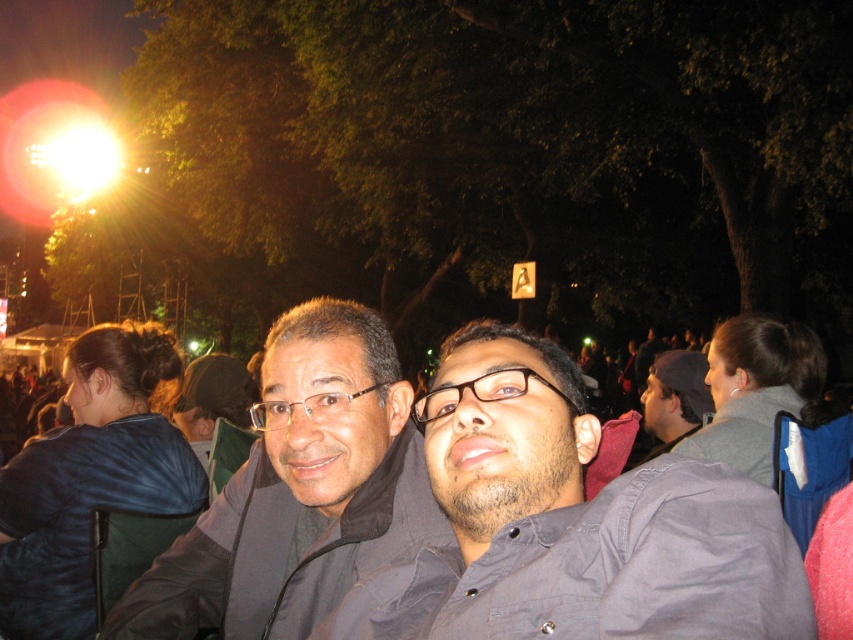
You are organizing a photo shoot and need to ensure that the dark gray shirt at center and the matte black jacket at center can fit side by side on a backdrop. The backdrop is 1.2 meters wide. What should you consider about their widths?

The dark gray shirt at center is narrower than the matte black jacket at center. To determine if they can fit side by side on a 1.2 meter backdrop, you need to know the combined width of both items. Since the jacket is wider, ensuring their total width does not exceed 1.2 meters is crucial.

Consider the image. You are a photographer trying to capture a clear photo of the dark gray shirt at center and the matte black jacket at center. Since both are at the center, which one is closer to the camera?

The dark gray shirt at center is in front of the matte black jacket at center, so it is closer to the camera.

You are organizing a photo shoot and need to ensure that the dark gray shirt at center and the blue fabric at center are visible in the frame. Given their sizes, which object should you focus on to ensure both are in the shot?

The dark gray shirt at center has a smaller size compared to blue fabric at center. To ensure both are visible in the shot, focus on framing the larger blue fabric at center first, then adjust the camera to include the smaller dark gray shirt at center.